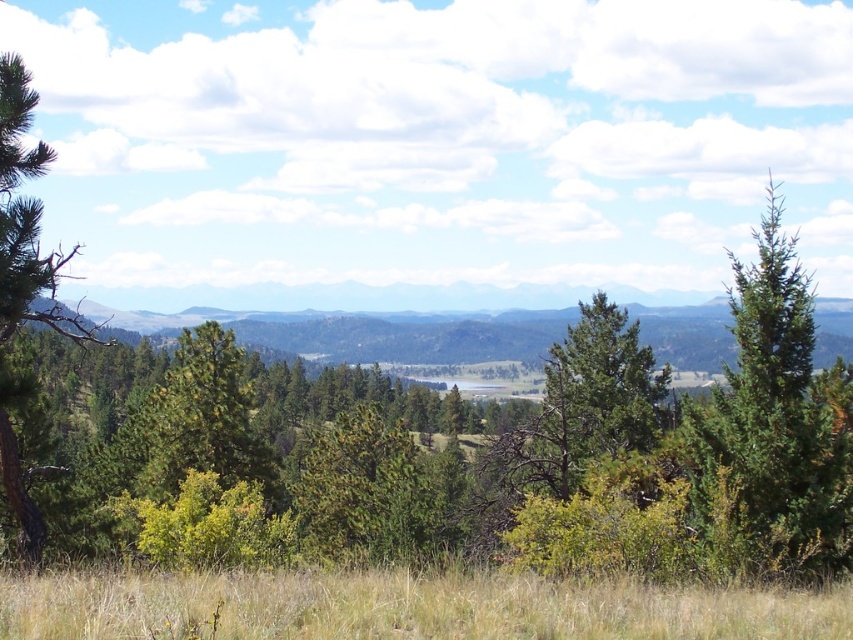
Question: Which of the following is the closest to the observer?

Choices:
 (A) (22, 216)
 (B) (791, 570)
 (C) (50, 632)

Answer: (C)

Question: Which object is positioned farthest from the green matte tree at left?

Choices:
 (A) green grass at lower center
 (B) green needle-like at right

Answer: (B)

Question: Which object is the closest to the green needle-like at right?

Choices:
 (A) green grass at lower center
 (B) green matte tree at left

Answer: (B)

Question: Can you confirm if green grass at lower center is smaller than green needle-like at right?

Choices:
 (A) yes
 (B) no

Answer: (A)

Question: Is green grass at lower center above green needle-like at right?

Choices:
 (A) yes
 (B) no

Answer: (B)

Question: Is green needle-like at right wider than green matte tree at left?

Choices:
 (A) yes
 (B) no

Answer: (A)